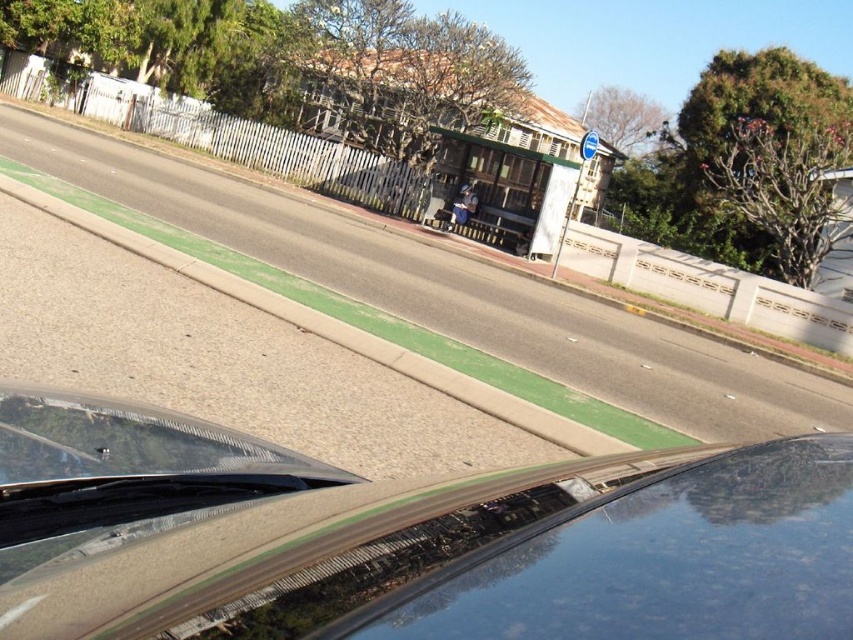
You are a passenger in the glossy black car at center and want to look out the glossy black windshield at center. In which direction should you turn your head to face the windshield?

You should turn your head to the right because the glossy black car at center is to the left of the glossy black windshield at center, meaning the windshield is on your right side.

You are driving a glossy black car at center and want to park it in a parking spot that is the same width as your glossy black windshield at center. Will the car fit without hitting the sides?

The glossy black car at center might be wider than the glossy black windshield at center, so there is a possibility that the car will not fit in the parking spot and may hit the sides.

You are driving a glossy black car at center and want to ensure there is enough space to park it without hitting the glossy black windshield at center. Based on the scene, can you determine if the car will fit in the parking spot without damaging the windshield?

The glossy black car at center is larger in size than the glossy black windshield at center, so the car will fit in the parking spot without damaging the windshield.